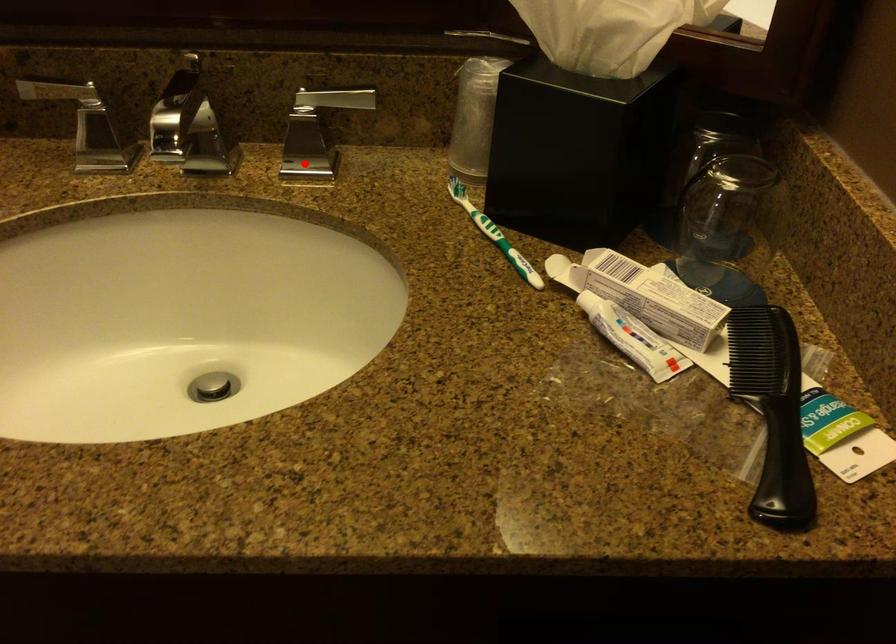
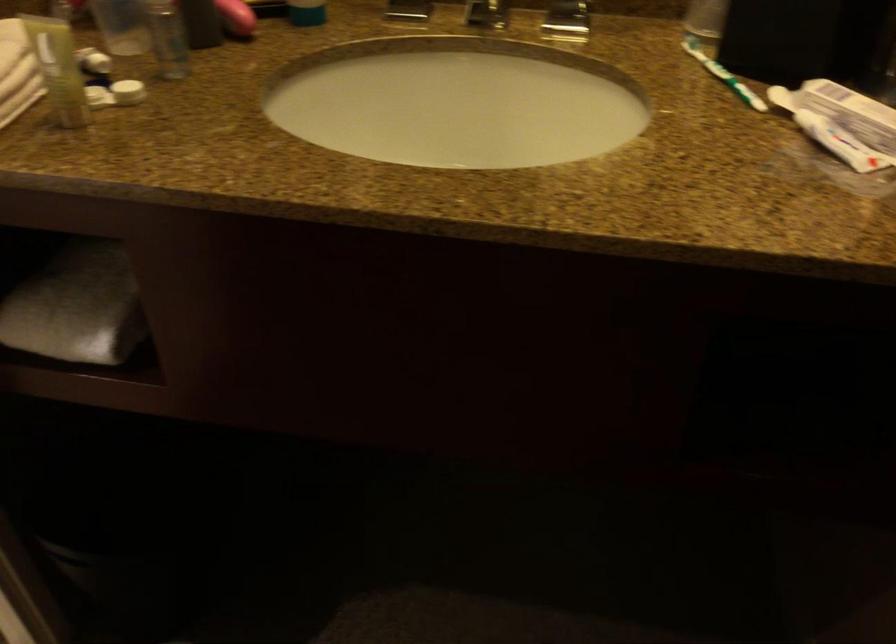
Where in the second image is the point corresponding to the highlighted location from the first image?

(566, 21)